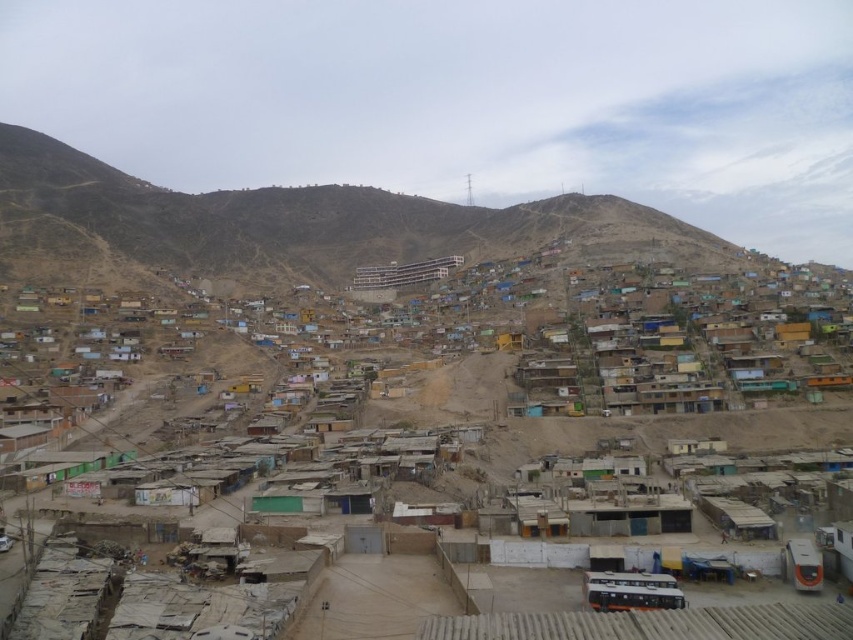
In the scene shown: You are a drone operator tasked with capturing aerial footage of the hillside settlement. Your camera has a minimum focus distance of 100 meters. Can you focus on the point at coordinates point (566, 419) without moving the camera?

The point at coordinates point (566, 419) is 150.98 meters away from the camera, which is beyond the minimum focus distance of 100 meters. Therefore, the drone operator can focus on the point at coordinates point (566, 419) without moving the camera.

You are a drone operator tasked with capturing aerial footage of the settlement. You notice the rustic adobe houses at center and the dull brown hillside at upper center. Which of these two features would require a wider camera frame to fully capture in your shot?

The dull brown hillside at upper center requires a wider camera frame because its width is greater than the rustic adobe houses at center.